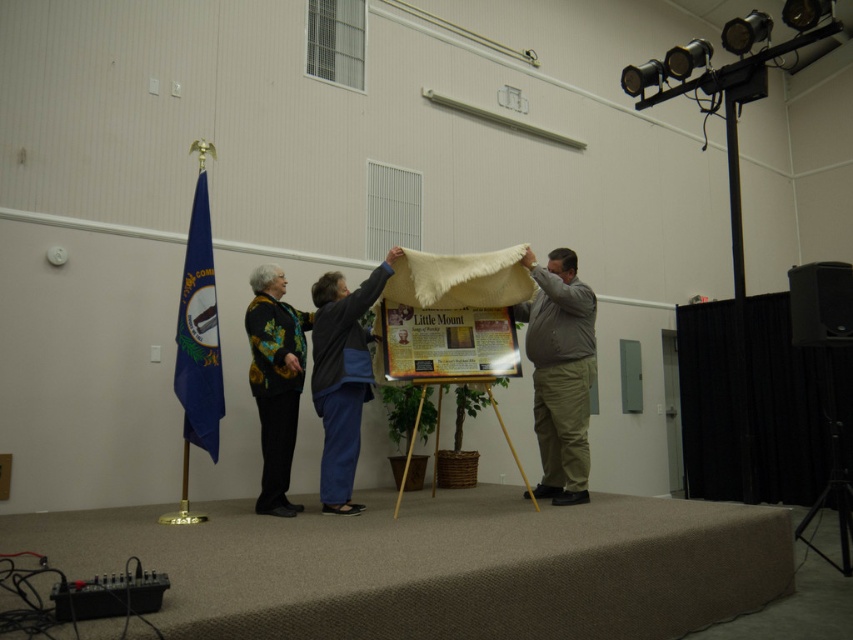
You are an event organizer setting up for a presentation. You need to ensure that the blue fabric flag at left and the black plastic speaker at right are positioned so that the flag is clearly visible to the audience. Given their sizes, which object might you need to adjust to achieve this?

The blue fabric flag at left occupies less space than the black plastic speaker at right. To ensure the flag is clearly visible, you might need to adjust the position of the black plastic speaker at right to avoid blocking the smaller flag.

You are a stagehand setting up for a performance. You need to place a microphone stand exactly between the blue denim pants at center and the black plastic speaker at right. Where should you position it?

The microphone stand should be placed between the blue denim pants at center and the black plastic speaker at right, since the blue denim pants at center is to the left of the black plastic speaker at right.

You are a stagehand measuring the space between two items on the stage. You need to place a 50 cm wide decorative panel between them. Can the panel fit without overlapping either the khaki cotton pants at center or the matte paper bulletin board at center?

The distance between the khaki cotton pants at center and the matte paper bulletin board at center is 57.25 centimeters. Since the panel is 50 cm wide, it can fit within the space as 50 cm is less than 57.25 cm, allowing placement without overlapping either object.